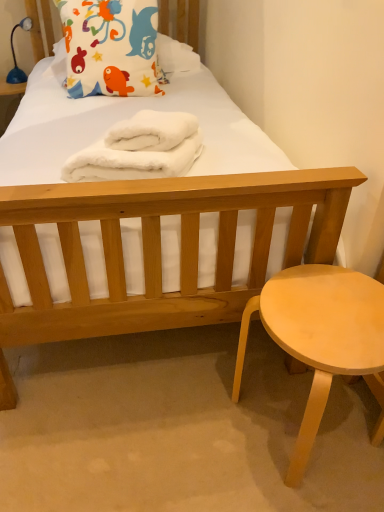
This screenshot has height=512, width=384. Find the location of `free spot above light wood stool at lower right (from a real-world perspective)`. free spot above light wood stool at lower right (from a real-world perspective) is located at coordinates (329, 313).